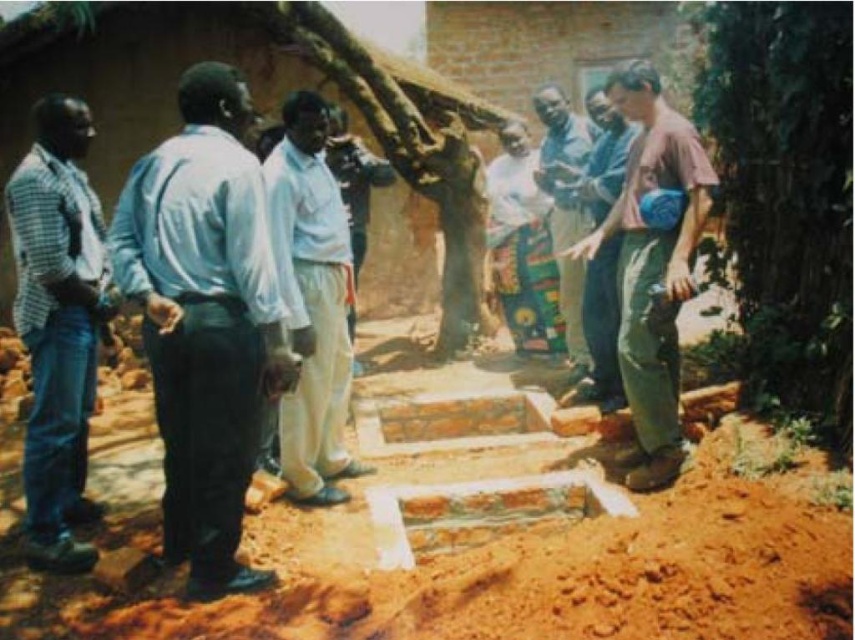
Based on the photo, you are a new worker arriving at the construction site and see the light blue shirt at left and the blue jeans at right. Which person should you approach first if you need guidance?

The light blue shirt at left is positioned on the left side of blue jeans at right, so you should approach the light blue shirt at left first as it is closer to your left side.

You are a delivery person who needs to place a large package that is 2 feet wide. You see the pink fabric bag at right and the white matte shirt at center. Which object can accommodate the package if the package must be placed on top of either the bag or the shirt?

The pink fabric bag at right might be wider than the white matte shirt at center, so it could potentially accommodate the package if its width is sufficient. However, without exact measurements, it is uncertain. The safest option would be to check the actual dimensions of the pink fabric bag at right before placing the package.

Based on the photo, you are a photographer at the construction site. You want to take a group photo of the light blue shirt at left and pink fabric bag at right. Which object should you focus on first if you want to capture both in the frame without moving the camera?

The light blue shirt at left is smaller than the pink fabric bag at right, so you should focus on the pink fabric bag at right first to ensure both are in frame.